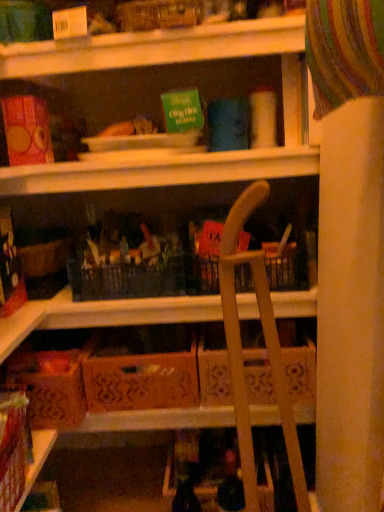
Question: Is wooden folding chair at center positioned in front of brown cardboard box at lower left, which is counted as the 1th cardboard box, starting from the left?

Choices:
 (A) no
 (B) yes

Answer: (B)

Question: Could brown cardboard box at lower left, which is counted as the 1th cardboard box, starting from the left, be considered to be inside wooden folding chair at center?

Choices:
 (A) yes
 (B) no

Answer: (B)

Question: Is wooden folding chair at center smaller than brown cardboard box at lower left, which is counted as the 1th cardboard box, starting from the left?

Choices:
 (A) no
 (B) yes

Answer: (A)

Question: From a real-world perspective, is wooden folding chair at center located higher than brown cardboard box at lower left, which is counted as the 1th cardboard box, starting from the left?

Choices:
 (A) no
 (B) yes

Answer: (B)

Question: From the image's perspective, is wooden folding chair at center over brown cardboard box at lower left, the 2th cardboard box when ordered from right to left?

Choices:
 (A) yes
 (B) no

Answer: (A)

Question: Is brown cardboard box at lower left, which is counted as the 1th cardboard box, starting from the left, to the left or to the right of orange cardboard box at center, marked as the 1th cardboard box in a right-to-left arrangement, in the image?

Choices:
 (A) right
 (B) left

Answer: (B)

Question: From a real-world perspective, is brown cardboard box at lower left, which is counted as the 1th cardboard box, starting from the left, positioned above or below orange cardboard box at center, which is counted as the 2th cardboard box, starting from the left?

Choices:
 (A) below
 (B) above

Answer: (B)

Question: In the image, is brown cardboard box at lower left, the 2th cardboard box when ordered from right to left, positioned in front of or behind orange cardboard box at center, marked as the 1th cardboard box in a right-to-left arrangement?

Choices:
 (A) behind
 (B) front

Answer: (B)

Question: In terms of height, does brown cardboard box at lower left, which is counted as the 1th cardboard box, starting from the left, look taller or shorter compared to orange cardboard box at center, marked as the 1th cardboard box in a right-to-left arrangement?

Choices:
 (A) tall
 (B) short

Answer: (A)

Question: Considering their positions, is brown cardboard box at lower left, which is counted as the 1th cardboard box, starting from the left, located in front of or behind wooden folding chair at center?

Choices:
 (A) behind
 (B) front

Answer: (A)

Question: From the image's perspective, relative to wooden folding chair at center, is brown cardboard box at lower left, the 2th cardboard box when ordered from right to left, above or below?

Choices:
 (A) above
 (B) below

Answer: (B)

Question: Is brown cardboard box at lower left, the 2th cardboard box when ordered from right to left, to the left or to the right of wooden folding chair at center in the image?

Choices:
 (A) left
 (B) right

Answer: (A)

Question: Considering the positions of brown cardboard box at lower left, the 2th cardboard box when ordered from right to left, and wooden folding chair at center in the image, is brown cardboard box at lower left, the 2th cardboard box when ordered from right to left, bigger or smaller than wooden folding chair at center?

Choices:
 (A) big
 (B) small

Answer: (B)

Question: Is point 269,346 positioned closer to the camera than point 190,369?

Choices:
 (A) farther
 (B) closer

Answer: (B)

Question: Looking at the image, does wooden folding chair at center seem bigger or smaller compared to orange cardboard box at center, which is counted as the 2th cardboard box, starting from the left?

Choices:
 (A) big
 (B) small

Answer: (A)